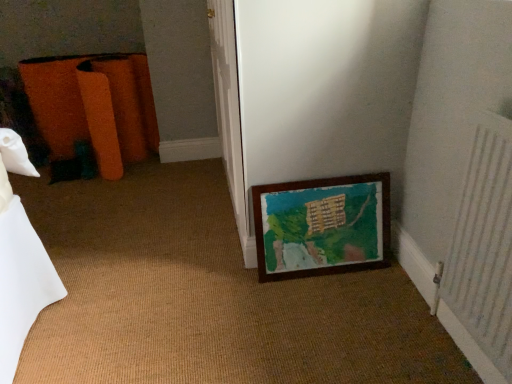
Question: Is orange fabric bag at left turned away from white textured radiator at right?

Choices:
 (A) no
 (B) yes

Answer: (A)

Question: Is orange fabric bag at left shorter than white textured radiator at right?

Choices:
 (A) yes
 (B) no

Answer: (A)

Question: Is orange fabric bag at left outside white textured radiator at right?

Choices:
 (A) yes
 (B) no

Answer: (A)

Question: Can you confirm if orange fabric bag at left is wider than white textured radiator at right?

Choices:
 (A) no
 (B) yes

Answer: (B)

Question: Could you tell me if orange fabric bag at left is turned towards white textured radiator at right?

Choices:
 (A) yes
 (B) no

Answer: (B)

Question: Considering the positions of wooden frame at lower right and orange fabric bag at left in the image, is wooden frame at lower right bigger or smaller than orange fabric bag at left?

Choices:
 (A) big
 (B) small

Answer: (B)

Question: Considering the positions of wooden frame at lower right and orange fabric bag at left in the image, is wooden frame at lower right wider or thinner than orange fabric bag at left?

Choices:
 (A) wide
 (B) thin

Answer: (B)

Question: From a real-world perspective, is wooden frame at lower right physically located above or below orange fabric bag at left?

Choices:
 (A) above
 (B) below

Answer: (B)

Question: Is wooden frame at lower right situated inside orange fabric bag at left or outside?

Choices:
 (A) outside
 (B) inside

Answer: (A)

Question: From a real-world perspective, is orange fabric bag at left above or below white textured radiator at right?

Choices:
 (A) below
 (B) above

Answer: (A)

Question: Based on their sizes in the image, would you say orange fabric bag at left is bigger or smaller than white textured radiator at right?

Choices:
 (A) small
 (B) big

Answer: (B)

Question: Does point coord(140,69) appear closer or farther from the camera than point coord(492,302)?

Choices:
 (A) farther
 (B) closer

Answer: (A)

Question: Is orange fabric bag at left inside the boundaries of white textured radiator at right, or outside?

Choices:
 (A) inside
 (B) outside

Answer: (B)

Question: Would you say wooden frame at lower right is inside or outside white textured radiator at right?

Choices:
 (A) outside
 (B) inside

Answer: (A)

Question: Is wooden frame at lower right to the left or to the right of white textured radiator at right in the image?

Choices:
 (A) right
 (B) left

Answer: (B)